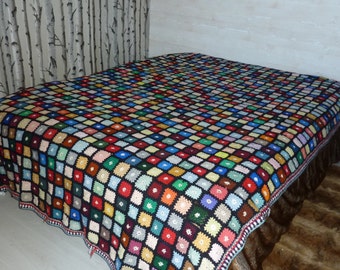
Where is `wall`? This screenshot has height=270, width=340. wall is located at coordinates (252, 21).